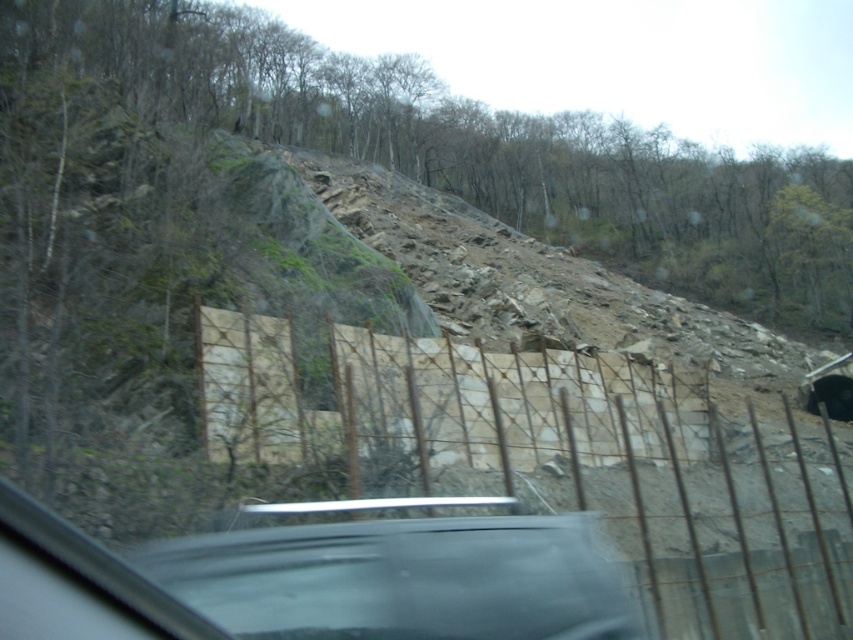
You are a driver trying to navigate through a narrow mountain road. You notice a brown woven wire fence at center and a green mossy rock at upper left in your view. Which object would you need to avoid hitting if you drift too far to the left?

The brown woven wire fence at center is smaller in size compared to the green mossy rock at upper left, so you should avoid hitting the brown woven wire fence at center if you drift too far to the left.

You are driving a car and want to know if the brown woven wire fence at center can fit entirely within the space occupied by the green mossy rock at upper left. Based on their sizes, can it?

The brown woven wire fence at center is narrower than the green mossy rock at upper left, so it can fit within the space occupied by the green mossy rock at upper left.